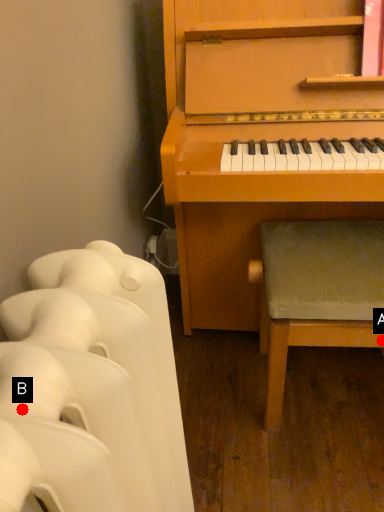
Question: Two points are circled on the image, labeled by A and B beside each circle. Which point is closer to the camera taking this photo?

Choices:
 (A) A is closer
 (B) B is closer

Answer: (B)